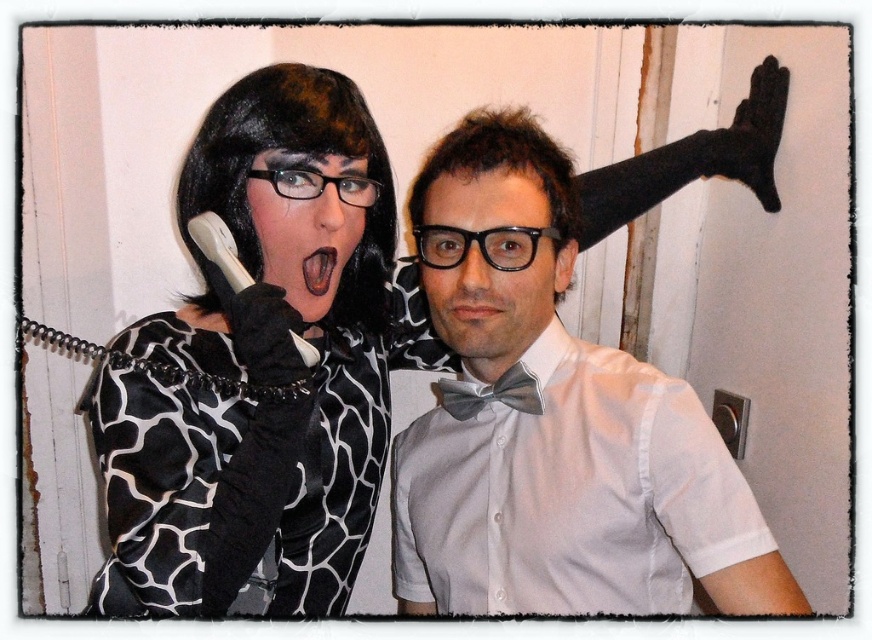
Between matte black wig at upper left and gray satin bow tie at center, which one is positioned higher?

matte black wig at upper left

Which is below, matte black wig at upper left or gray satin bow tie at center?

gray satin bow tie at center

This screenshot has width=872, height=640. What are the coordinates of `matte black wig at upper left` in the screenshot? It's located at (263, 365).

Find the location of a particular element. white matte bow tie at upper right is located at coordinates (554, 422).

Can you confirm if white matte bow tie at upper right is positioned above black matte tongue at center?

No, white matte bow tie at upper right is not above black matte tongue at center.

Is point (462, 244) farther from camera compared to point (329, 244)?

No, (462, 244) is closer to viewer.

Find the location of a particular element. white matte bow tie at upper right is located at coordinates (554, 422).

Looking at this image, is matte black wig at upper left below white matte bow tie at upper right?

No, matte black wig at upper left is not below white matte bow tie at upper right.

Does matte black wig at upper left have a larger size compared to white matte bow tie at upper right?

Yes, matte black wig at upper left is bigger than white matte bow tie at upper right.

Locate an element on the screen. matte black wig at upper left is located at coordinates (263, 365).